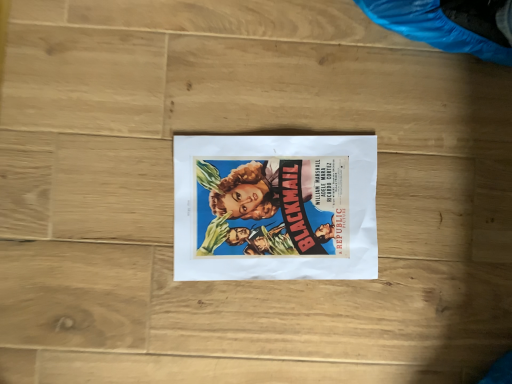
What do you see at coordinates (275, 207) in the screenshot? Image resolution: width=512 pixels, height=384 pixels. I see `matte paper poster at center` at bounding box center [275, 207].

In order to face matte paper poster at center, should I rotate leftwards or rightwards?

Turn right by 2.828 degrees to look at matte paper poster at center.

Locate an element on the screen. matte paper poster at center is located at coordinates pyautogui.click(x=275, y=207).

Where is `matte paper poster at center`? matte paper poster at center is located at coordinates (275, 207).